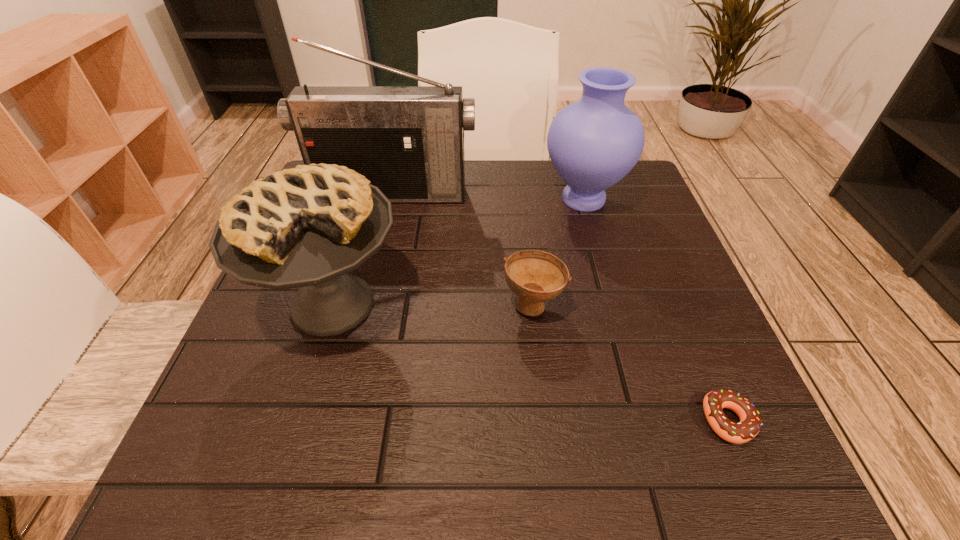
What are the coordinates of `radio receiver` in the screenshot? It's located at (408, 141).

Find the location of `vase`. vase is located at coordinates click(593, 143).

You are a GUI agent. You are given a task and a screenshot of the screen. Output one action in this format:
    pyautogui.click(x=<x>, y=<y>)
    Task: Click on the third shortest object
    
    Given the screenshot: What is the action you would take?
    pyautogui.click(x=309, y=226)

Identify the location of soup bowl. (535, 276).

At what (x,y) coordinates should I click in order to perform the action: click on doughnut. Please return your answer as a coordinate pair (x, y). Looking at the image, I should click on (750, 423).

Identify the location of the nearest object. This screenshot has height=540, width=960. (750, 423).

Locate an element on the screen. The height and width of the screenshot is (540, 960). vacant space located on the front-facing side of the tallest object is located at coordinates (375, 264).

Image resolution: width=960 pixels, height=540 pixels. In order to click on vacant point located on the front of the vase in this screenshot , I will do `click(597, 246)`.

The image size is (960, 540). In order to click on vacant point located 0.170m on the cut side of the pie in this screenshot , I will do `click(279, 474)`.

Where is `vacant area situated on the left of the second shortest object`? This screenshot has height=540, width=960. vacant area situated on the left of the second shortest object is located at coordinates click(x=469, y=304).